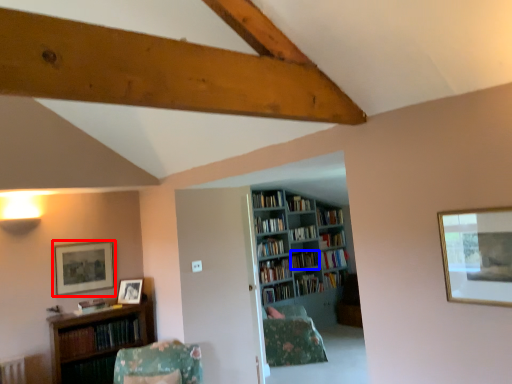
Question: Which object appears farthest to the camera in this image, picture frame (highlighted by a red box) or book (highlighted by a blue box)?

Choices:
 (A) picture frame
 (B) book

Answer: (B)